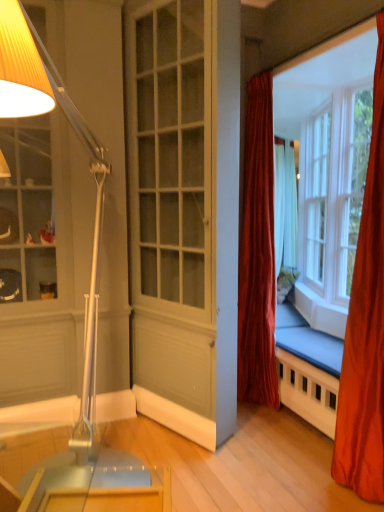
Question: Does white painted wood screen door at center have a greater height compared to velvet red curtain at center, the 2th curtain when ordered from front to back?

Choices:
 (A) no
 (B) yes

Answer: (B)

Question: Is white painted wood screen door at center smaller than velvet red curtain at center, the 2th curtain when ordered from front to back?

Choices:
 (A) yes
 (B) no

Answer: (B)

Question: Is velvet red curtain at center, placed as the first curtain when sorted from back to front, at the back of white painted wood screen door at center?

Choices:
 (A) yes
 (B) no

Answer: (A)

Question: From the image's perspective, does white painted wood screen door at center appear higher than velvet red curtain at center, the 2th curtain when ordered from front to back?

Choices:
 (A) no
 (B) yes

Answer: (B)

Question: Are white painted wood screen door at center and velvet red curtain at center, the 2th curtain when ordered from right to left, making contact?

Choices:
 (A) no
 (B) yes

Answer: (A)

Question: Is white painted wood screen door at center located outside velvet red curtain at center, the 2th curtain when ordered from right to left?

Choices:
 (A) yes
 (B) no

Answer: (A)

Question: Is metallic silver lamp at left turned away from velvet red curtain at center, the 2th curtain when ordered from right to left?

Choices:
 (A) yes
 (B) no

Answer: (B)

Question: Is metallic silver lamp at left taller than velvet red curtain at center, the 2th curtain when ordered from front to back?

Choices:
 (A) yes
 (B) no

Answer: (B)

Question: Is the surface of metallic silver lamp at left in direct contact with velvet red curtain at center, positioned as the 1th curtain in left-to-right order?

Choices:
 (A) no
 (B) yes

Answer: (A)

Question: Can you confirm if metallic silver lamp at left is shorter than velvet red curtain at center, placed as the first curtain when sorted from back to front?

Choices:
 (A) no
 (B) yes

Answer: (B)

Question: Considering the relative positions of metallic silver lamp at left and velvet red curtain at center, the 2th curtain when ordered from front to back, in the image provided, is metallic silver lamp at left in front of velvet red curtain at center, the 2th curtain when ordered from front to back,?

Choices:
 (A) no
 (B) yes

Answer: (B)

Question: Can you confirm if metallic silver lamp at left is wider than velvet red curtain at center, positioned as the 1th curtain in left-to-right order?

Choices:
 (A) no
 (B) yes

Answer: (B)

Question: Does velvet red curtain at center, placed as the first curtain when sorted from back to front, appear on the right side of clear glass window at upper right?

Choices:
 (A) no
 (B) yes

Answer: (A)